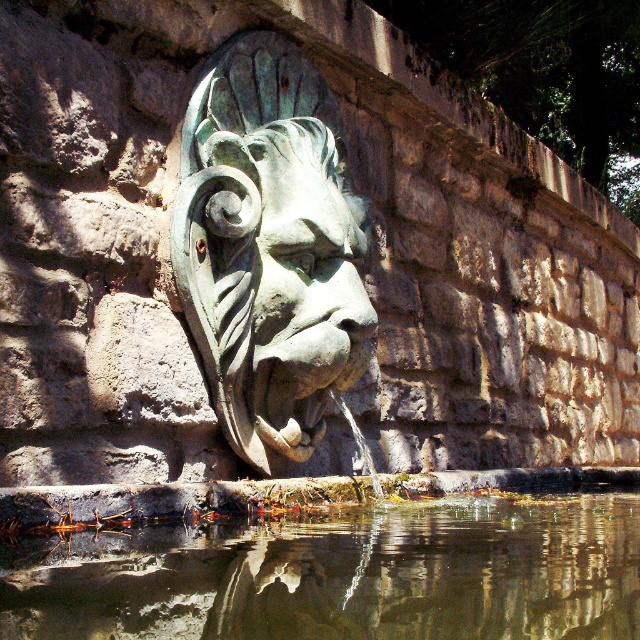
Question: Which is nearer to the green patina stone lion head at center?

Choices:
 (A) green patina stone face at center
 (B) clear water at lower center

Answer: (A)

Question: Which object is the closest to the green patina stone lion head at center?

Choices:
 (A) green patina stone face at center
 (B) clear water at lower center

Answer: (A)

Question: Does clear water at lower center have a smaller size compared to green patina stone face at center?

Choices:
 (A) no
 (B) yes

Answer: (A)

Question: Can you confirm if green patina stone lion head at center is positioned below green patina stone face at center?

Choices:
 (A) yes
 (B) no

Answer: (B)

Question: Does clear water at lower center appear on the right side of green patina stone lion head at center?

Choices:
 (A) yes
 (B) no

Answer: (A)

Question: Among these points, which one is farthest from the camera?

Choices:
 (A) (252, 442)
 (B) (348, 632)

Answer: (A)